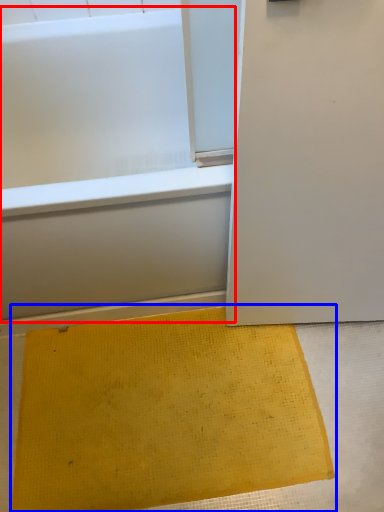
Question: Which point is closer to the camera, bathtub (highlighted by a red box) or doormat (highlighted by a blue box)?

Choices:
 (A) bathtub
 (B) doormat

Answer: (A)